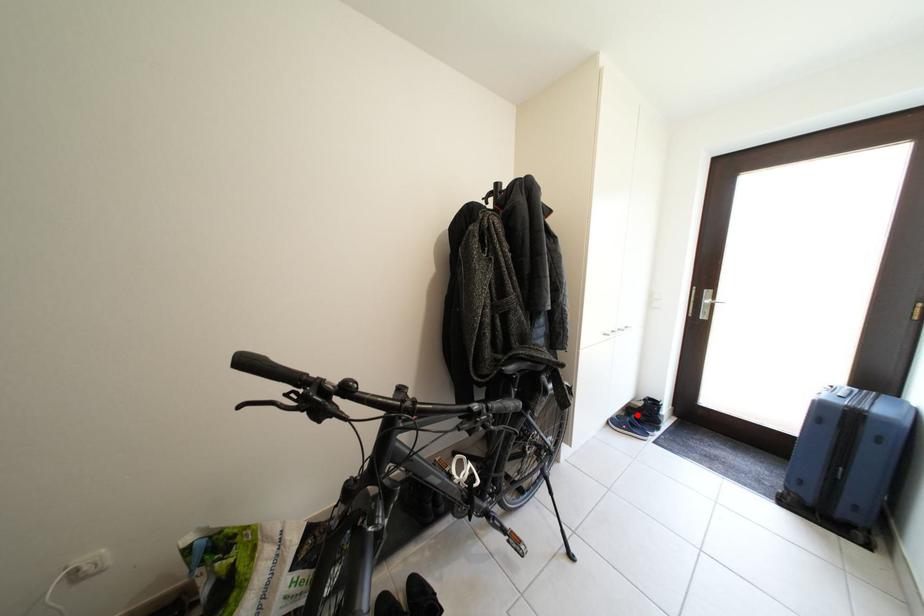
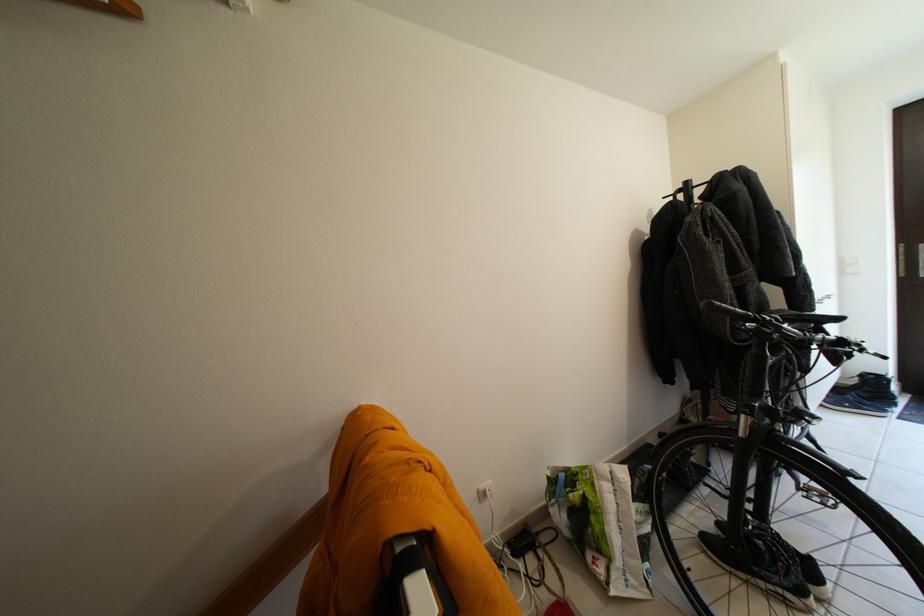
The point at the highlighted location is marked in the first image. Where is the corresponding point in the second image?

(845, 395)